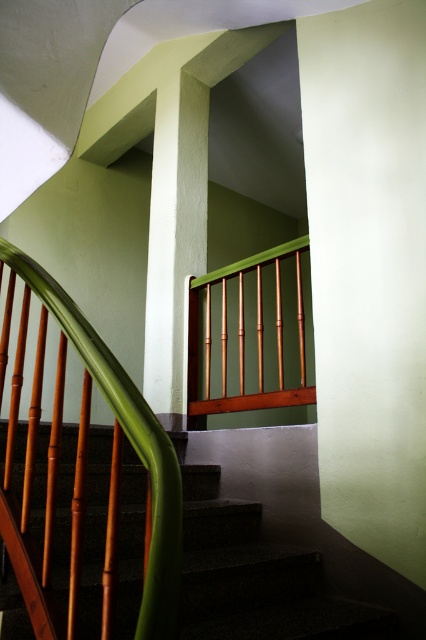
Does matte green wall at center appear over smooth white pillar at center?

No, matte green wall at center is not above smooth white pillar at center.

Is point (360, 86) more distant than point (198, 228)?

No, it is in front of (198, 228).

This screenshot has height=640, width=426. I want to click on matte green wall at center, so click(368, 269).

Locate an element on the screen. matte green wall at center is located at coordinates (368, 269).

Which is behind, point (388, 440) or point (195, 346)?

The point (195, 346) is behind.

Is point (373, 476) farther from viewer compared to point (213, 403)?

No, it is in front of (213, 403).

Where is `matte green wall at center`? matte green wall at center is located at coordinates (368, 269).

Measure the distance between smooth concrete stairs at center and smooth white pillar at center.

smooth concrete stairs at center is 1.33 meters away from smooth white pillar at center.

Does smooth concrete stairs at center have a smaller size compared to smooth white pillar at center?

No.

Which is in front, point (23, 444) or point (204, 266)?

Point (23, 444)

This screenshot has width=426, height=640. What are the coordinates of `smooth concrete stairs at center` in the screenshot? It's located at (256, 577).